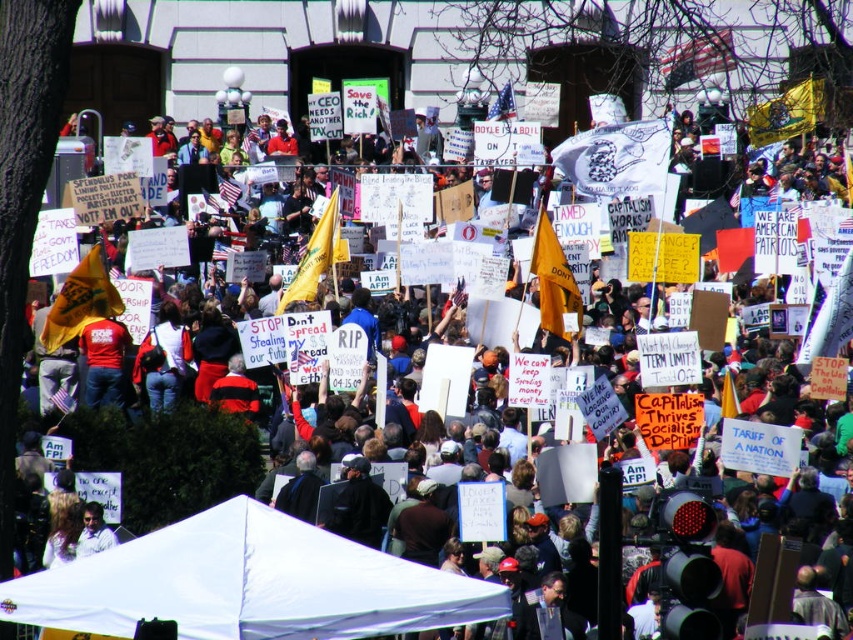
Is white fabric tent at center shorter than light brown hair at lower left?

Incorrect, white fabric tent at center's height does not fall short of light brown hair at lower left's.

Locate an element on the screen. The height and width of the screenshot is (640, 853). white fabric tent at center is located at coordinates (248, 582).

Which is in front, point (280, 604) or point (97, 524)?

Positioned in front is point (280, 604).

Where is `white fabric tent at center`? white fabric tent at center is located at coordinates (x=248, y=582).